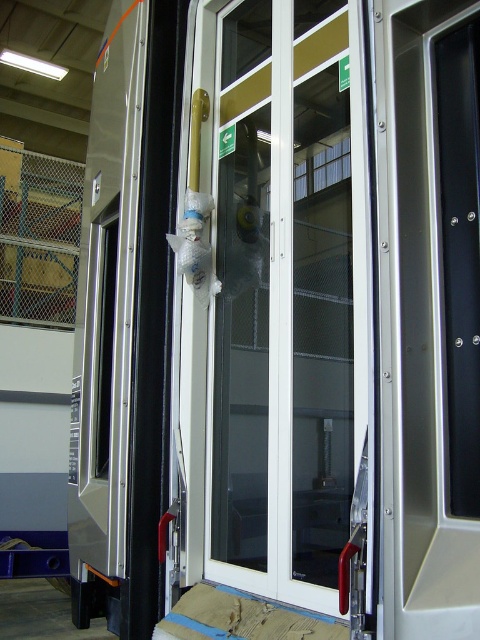
Question: Which object appears farthest from the camera in this image?

Choices:
 (A) satin silver panel at right
 (B) transparent plastic door at center

Answer: (B)

Question: Does transparent plastic door at center appear on the right side of satin silver panel at right?

Choices:
 (A) yes
 (B) no

Answer: (B)

Question: Is transparent plastic door at center to the left of satin silver panel at right from the viewer's perspective?

Choices:
 (A) no
 (B) yes

Answer: (B)

Question: Where is transparent plastic door at center located in relation to satin silver panel at right in the image?

Choices:
 (A) right
 (B) left

Answer: (B)

Question: Which point is farther to the camera?

Choices:
 (A) (469, 234)
 (B) (283, 282)

Answer: (B)

Question: Which point is farther to the camera?

Choices:
 (A) satin silver panel at right
 (B) transparent plastic door at center

Answer: (B)